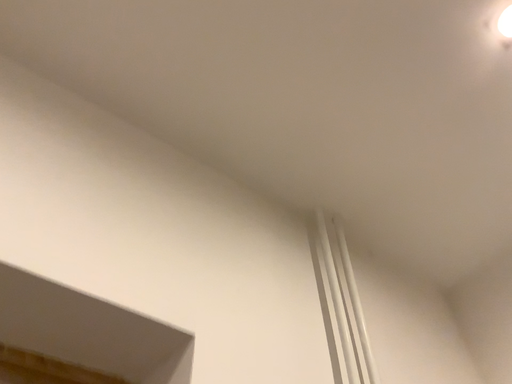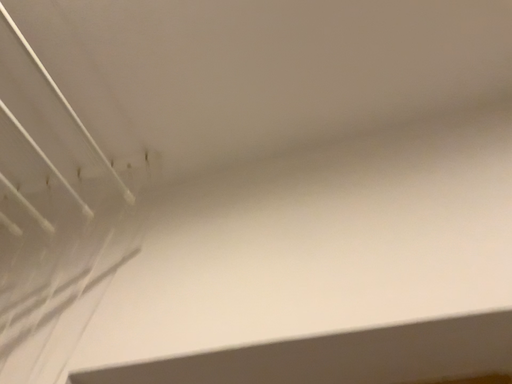
Question: Which way did the camera rotate in the video?

Choices:
 (A) rotated downward
 (B) rotated upward

Answer: (A)